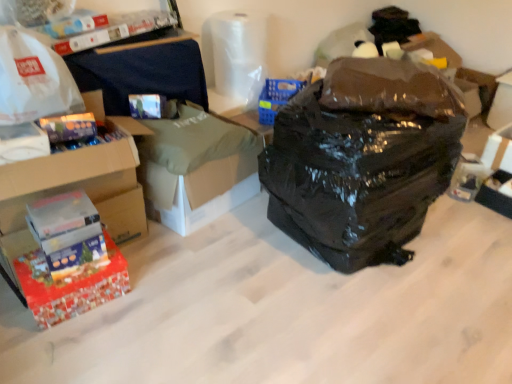
Image resolution: width=512 pixels, height=384 pixels. Find the location of `vacant space in front of black plastic bag at center`. vacant space in front of black plastic bag at center is located at coordinates (362, 321).